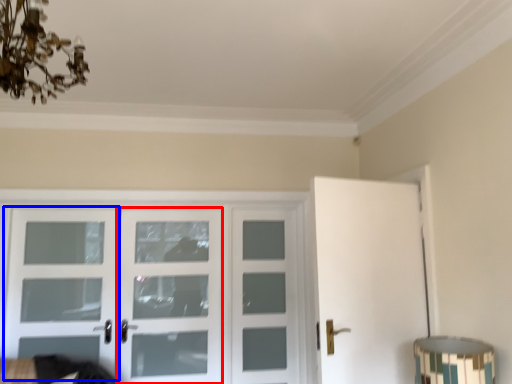
Question: Which of the following is the farthest to the observer, screen door (highlighted by a red box) or screen door (highlighted by a blue box)?

Choices:
 (A) screen door
 (B) screen door

Answer: (A)